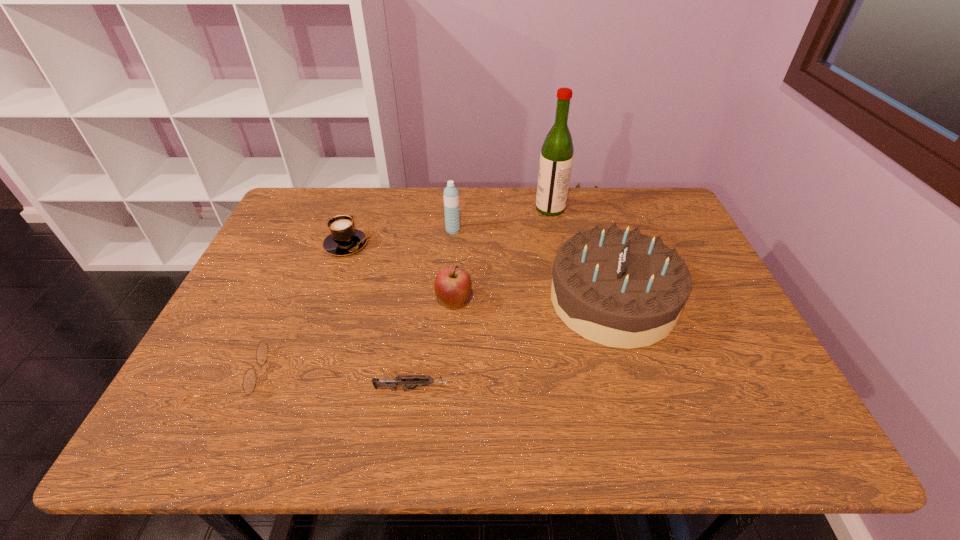
Where is `free location at the far right corner`? This screenshot has width=960, height=540. free location at the far right corner is located at coordinates (660, 213).

Where is `empty space that is in between the birthday cake and the fourth tallest object`? The image size is (960, 540). empty space that is in between the birthday cake and the fourth tallest object is located at coordinates (534, 301).

This screenshot has height=540, width=960. I want to click on free space between the third shortest object and the gun, so click(x=380, y=317).

The height and width of the screenshot is (540, 960). In order to click on blank region between the apple and the leftmost object in this screenshot , I will do `click(344, 339)`.

Identify the location of empty space between the spectacles and the farthest object. Image resolution: width=960 pixels, height=540 pixels. pos(392,292).

Where is `free space between the birthday cake and the water bottle`? The width and height of the screenshot is (960, 540). free space between the birthday cake and the water bottle is located at coordinates (533, 265).

Locate an element on the screen. free space that is in between the liquor and the gun is located at coordinates (482, 299).

This screenshot has height=540, width=960. I want to click on empty space between the birthday cake and the leftmost object, so click(x=423, y=338).

Image resolution: width=960 pixels, height=540 pixels. I want to click on vacant area between the apple and the cappuccino, so click(x=400, y=273).

Choose which object is the nearest neighbor to the farthest object. Please provide its 2D coordinates. Your answer should be formatted as a tuple, i.e. [(x, y)], where the tuple contains the x and y coordinates of a point satisfying the conditions above.

[(618, 288)]